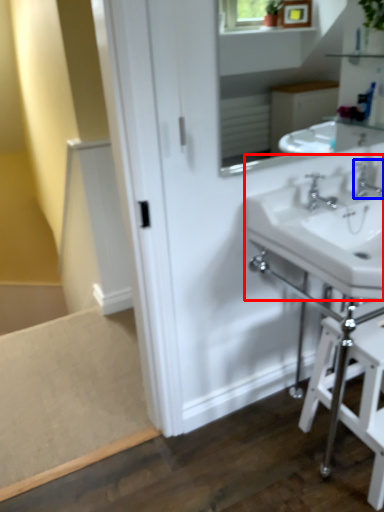
Question: Which of the following is the closest to the observer, sink (highlighted by a red box) or tap (highlighted by a blue box)?

Choices:
 (A) sink
 (B) tap

Answer: (A)